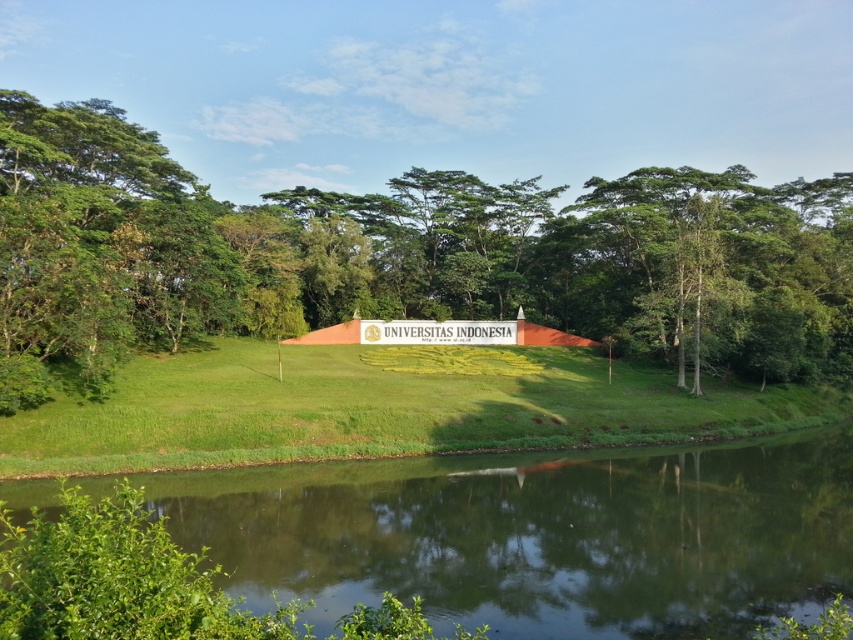
From the picture: Who is shorter, green leafy tree at center or green smooth water at lower center?

green smooth water at lower center

Can you confirm if green leafy tree at center is positioned to the left of green smooth water at lower center?

In fact, green leafy tree at center is to the right of green smooth water at lower center.

Does point (476, 179) come behind point (480, 532)?

That is True.

You are a GUI agent. You are given a task and a screenshot of the screen. Output one action in this format:
    pyautogui.click(x=<x>, y=<y>)
    Task: Click on the green leafy tree at center
    The image size is (853, 640).
    Given the screenshot: What is the action you would take?
    pyautogui.click(x=403, y=257)

Between point (695, 323) and point (640, 374), which one is positioned behind?

The point (640, 374) is more distant.

Based on the photo, can you confirm if green leafy tree at center is shorter than green grassy hill at center?

Incorrect, green leafy tree at center's height does not fall short of green grassy hill at center's.

Is point (67, 260) farther from viewer compared to point (372, 413)?

No.

In order to click on green leafy tree at center in this screenshot , I will do `click(403, 257)`.

Is point (444, 480) less distant than point (496, 445)?

Yes.

Which is in front, point (39, 492) or point (741, 387)?

Point (39, 492) is in front.

What are the coordinates of `green smooth water at lower center` in the screenshot? It's located at (538, 536).